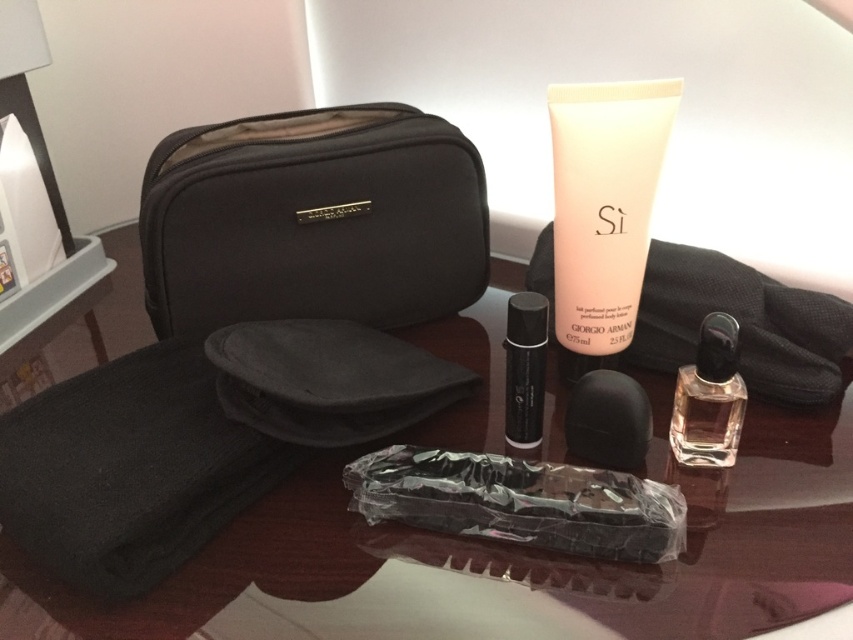
Question: Which object is positioned farthest from the transparent glass table at center?

Choices:
 (A) peach matte lotion at center
 (B) clear glass perfume at center right

Answer: (A)

Question: Can you confirm if transparent glass table at center is positioned to the left of peach matte lotion at center?

Choices:
 (A) yes
 (B) no

Answer: (A)

Question: Which object is farther from the camera taking this photo?

Choices:
 (A) black glass perfume at center
 (B) peach matte lotion at center
 (C) clear glass perfume at center right

Answer: (B)

Question: Which point is farther from the camera taking this photo?

Choices:
 (A) (257, 236)
 (B) (693, 406)
 (C) (254, 609)
 (D) (657, 147)

Answer: (A)

Question: Is peach matte lotion at center wider than clear glass perfume at center right?

Choices:
 (A) yes
 (B) no

Answer: (A)

Question: Can you confirm if transparent glass table at center is wider than black fabric toiletry bag at upper left?

Choices:
 (A) no
 (B) yes

Answer: (B)